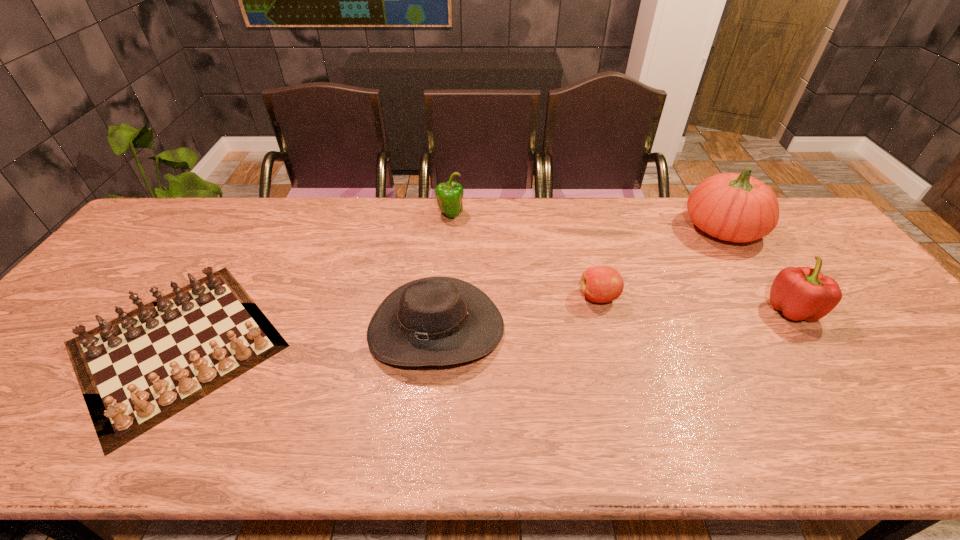
I want to click on pumpkin that is at the far edge, so click(734, 207).

This screenshot has width=960, height=540. What are the coordinates of `bell pepper present at the far edge` in the screenshot? It's located at (449, 195).

In the image, there is a desktop. Identify the location of vacant space at the far edge. This screenshot has width=960, height=540. (650, 227).

At what (x,y) coordinates should I click in order to perform the action: click on vacant area at the left edge. Please return your answer as a coordinate pair (x, y). Image resolution: width=960 pixels, height=540 pixels. Looking at the image, I should click on (97, 312).

Image resolution: width=960 pixels, height=540 pixels. What are the coordinates of `free space at the near left corner of the desktop` in the screenshot? It's located at (22, 428).

In the image, there is a desktop. In order to click on vacant area at the far right corner in this screenshot , I will do `click(798, 207)`.

The height and width of the screenshot is (540, 960). Identify the location of free space between the nearer bell pepper and the pumpkin. (757, 269).

Where is `free point between the farther bell pepper and the third object from right to left`? free point between the farther bell pepper and the third object from right to left is located at coordinates pos(525,256).

Locate an element on the screen. Image resolution: width=960 pixels, height=540 pixels. free point between the right bell pepper and the farther bell pepper is located at coordinates click(x=621, y=262).

Where is `free area in between the farther bell pepper and the fourth object from left to right`? free area in between the farther bell pepper and the fourth object from left to right is located at coordinates (525, 256).